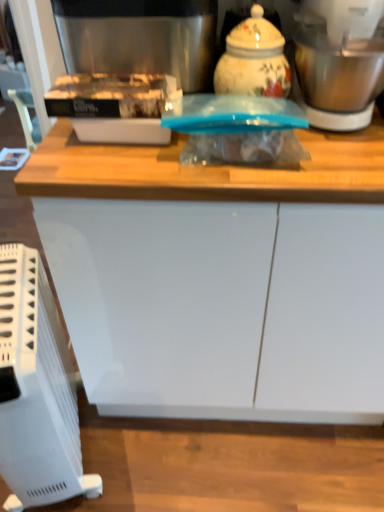
Question: Is white glossy cabinet at center positioned far away from white plastic heater at lower left?

Choices:
 (A) yes
 (B) no

Answer: (B)

Question: Is the depth of white glossy cabinet at center greater than that of white plastic heater at lower left?

Choices:
 (A) yes
 (B) no

Answer: (A)

Question: Is white glossy cabinet at center oriented away from white plastic heater at lower left?

Choices:
 (A) no
 (B) yes

Answer: (A)

Question: Is white glossy cabinet at center facing towards white plastic heater at lower left?

Choices:
 (A) yes
 (B) no

Answer: (B)

Question: Would you say white glossy cabinet at center is outside white plastic heater at lower left?

Choices:
 (A) yes
 (B) no

Answer: (A)

Question: Is matte plastic container at upper left in front of or behind stainless steel coffee machine at upper center in the image?

Choices:
 (A) behind
 (B) front

Answer: (B)

Question: Is point (145, 91) closer or farther from the camera than point (97, 10)?

Choices:
 (A) farther
 (B) closer

Answer: (A)

Question: In terms of width, does matte plastic container at upper left look wider or thinner when compared to stainless steel coffee machine at upper center?

Choices:
 (A) thin
 (B) wide

Answer: (A)

Question: From the image's perspective, is matte plastic container at upper left located above or below stainless steel coffee machine at upper center?

Choices:
 (A) above
 (B) below

Answer: (B)

Question: From the image's perspective, is stainless steel blender at upper right above or below matte plastic container at upper left?

Choices:
 (A) below
 (B) above

Answer: (B)

Question: Would you say stainless steel blender at upper right is to the left or to the right of matte plastic container at upper left in the picture?

Choices:
 (A) left
 (B) right

Answer: (B)

Question: Looking at their shapes, would you say stainless steel blender at upper right is wider or thinner than matte plastic container at upper left?

Choices:
 (A) wide
 (B) thin

Answer: (A)

Question: In terms of size, does stainless steel blender at upper right appear bigger or smaller than matte plastic container at upper left?

Choices:
 (A) small
 (B) big

Answer: (B)

Question: Does point (66, 458) appear closer or farther from the camera than point (92, 101)?

Choices:
 (A) farther
 (B) closer

Answer: (A)

Question: Based on their sizes in the image, would you say white plastic heater at lower left is bigger or smaller than matte plastic container at upper left?

Choices:
 (A) small
 (B) big

Answer: (B)